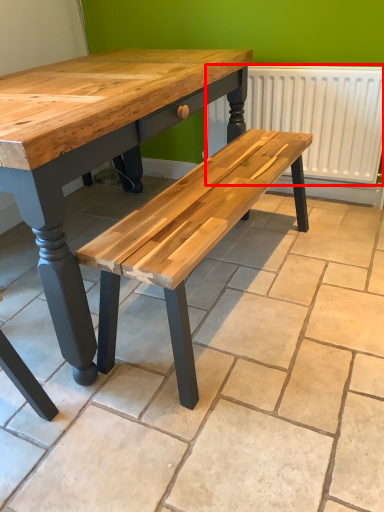
Question: In this image, where is radiator (annotated by the red box) located relative to tile?

Choices:
 (A) left
 (B) right

Answer: (B)